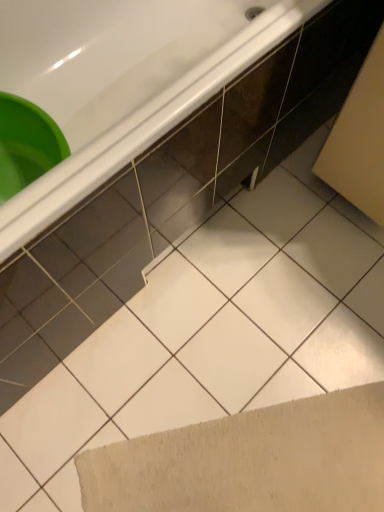
Question: Should I look upward or downward to see white glossy bathtub at upper left?

Choices:
 (A) up
 (B) down

Answer: (A)